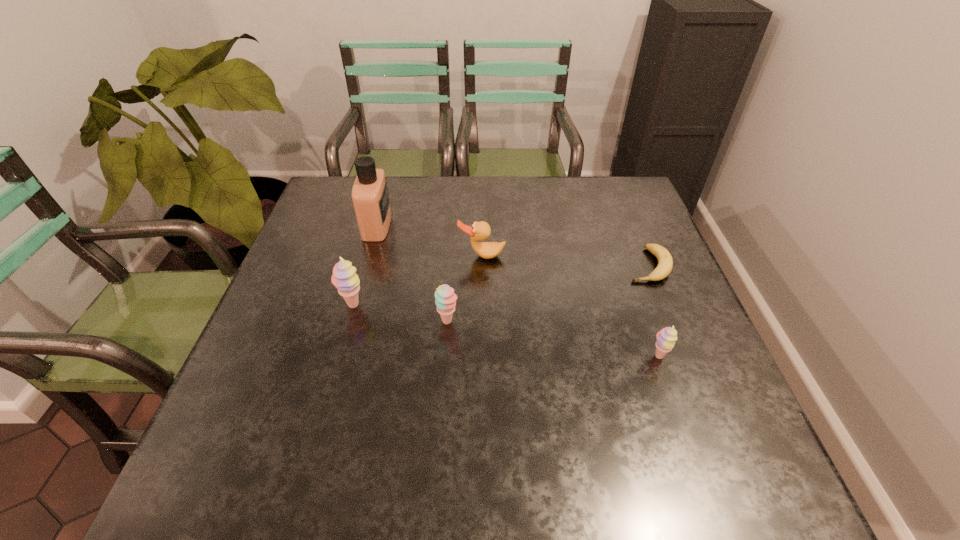
The image size is (960, 540). Identify the location of vacant space at the far edge of the desktop. (521, 184).

In order to click on free region at the near edge of the desktop in this screenshot , I will do `click(429, 402)`.

The image size is (960, 540). Identify the location of vacant space at the left edge. (313, 271).

Where is `blank space at the right edge of the desktop`? Image resolution: width=960 pixels, height=540 pixels. blank space at the right edge of the desktop is located at coordinates (652, 366).

You are a GUI agent. You are given a task and a screenshot of the screen. Output one action in this format:
    pyautogui.click(x=<x>, y=<y>)
    Task: Click on the vacant space at the far right corner
    The width and height of the screenshot is (960, 540).
    Given the screenshot: What is the action you would take?
    pyautogui.click(x=621, y=186)

Locate an element on the screen. This screenshot has height=540, width=960. vacant space that is in between the shortest object and the tallest sherbert is located at coordinates (500, 285).

Find the location of a particular element. blank region between the banana and the duck is located at coordinates (564, 260).

Identify the location of free spot between the tallest sherbert and the second sherbert from left to right. (400, 313).

What are the coordinates of `free point between the second tallest object and the duck` in the screenshot? It's located at (418, 281).

This screenshot has height=540, width=960. What are the coordinates of `free space between the banana and the tallest object` in the screenshot? It's located at (513, 245).